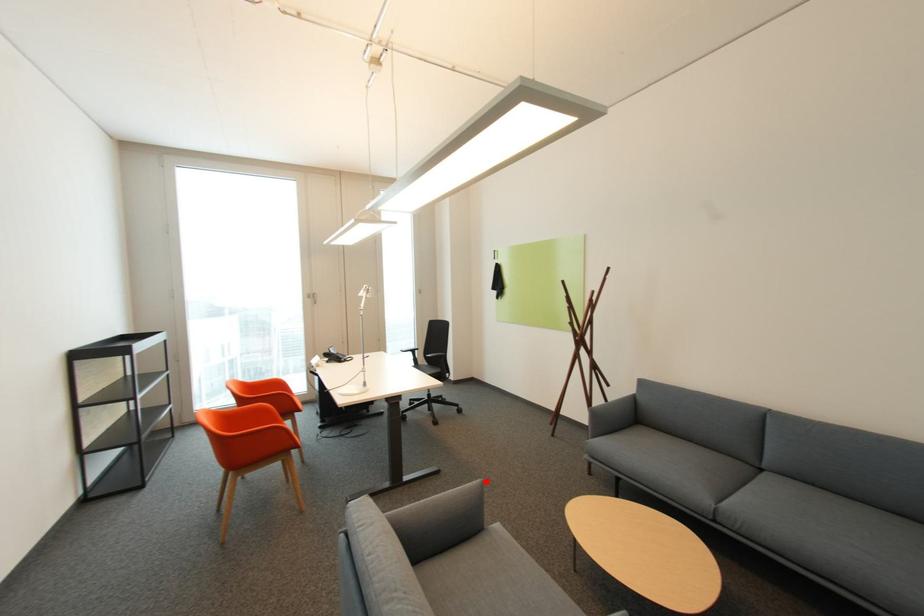
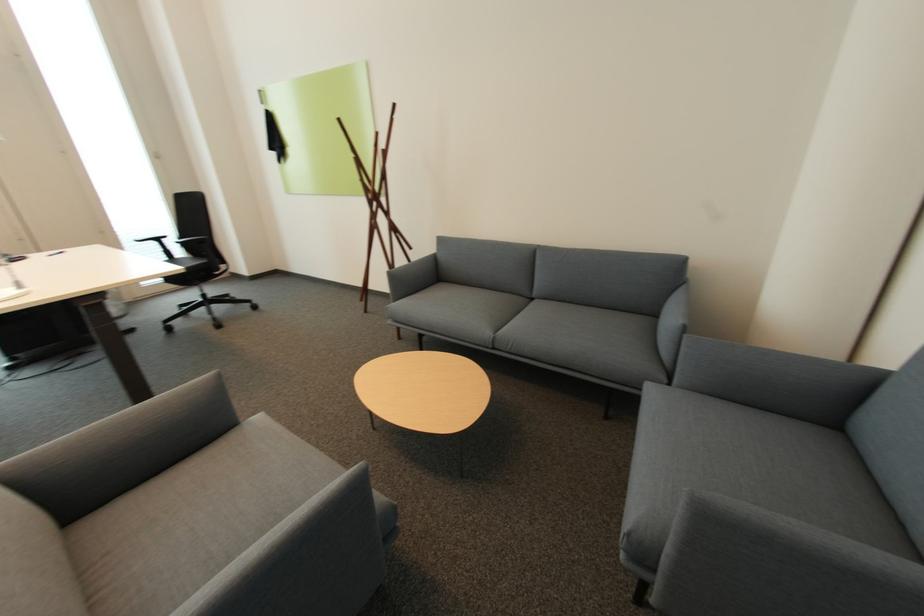
Locate, in the second image, the point that corresponds to the highlighted location in the first image.

(219, 373)